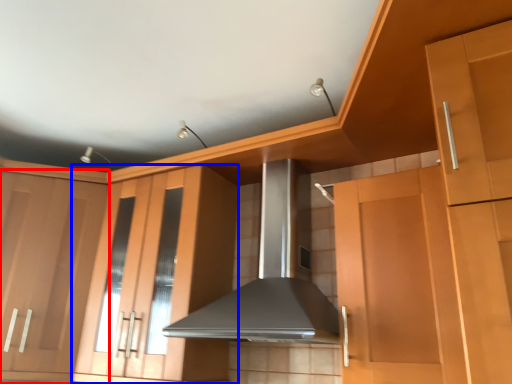
Question: Which point is closer to the camera, cabinetry (highlighted by a red box) or cabinetry (highlighted by a blue box)?

Choices:
 (A) cabinetry
 (B) cabinetry

Answer: (B)